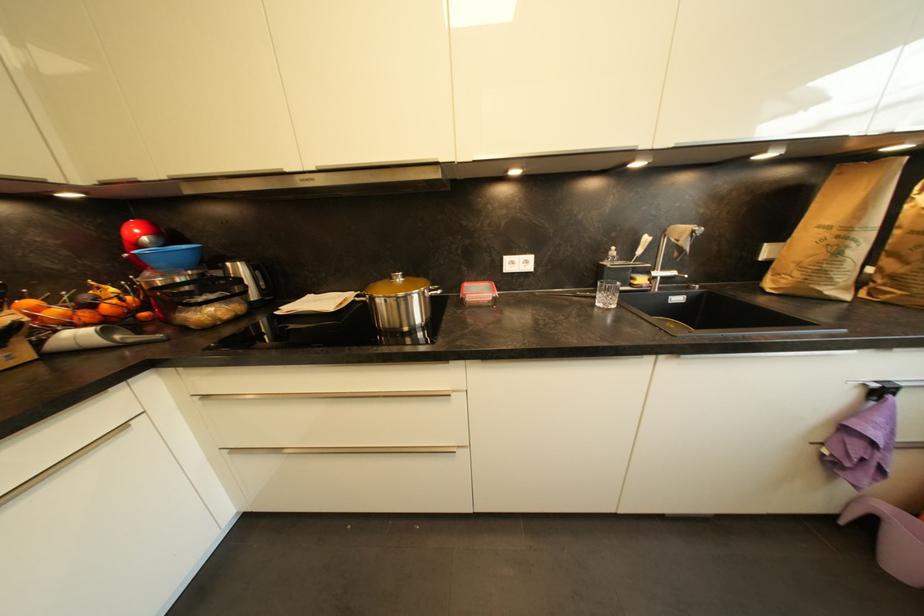
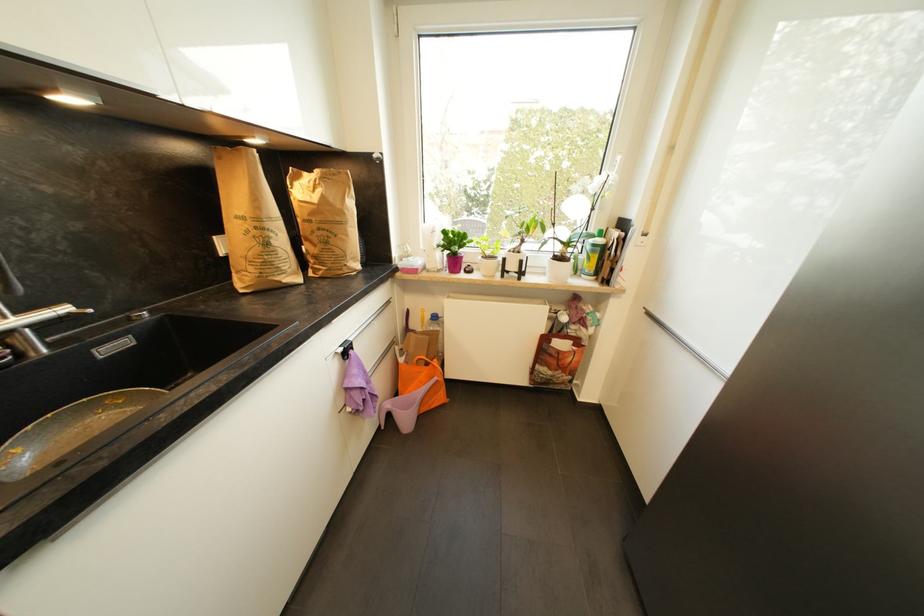
The point at [669,270] is marked in the first image. Where is the corresponding point in the second image?

(27, 313)